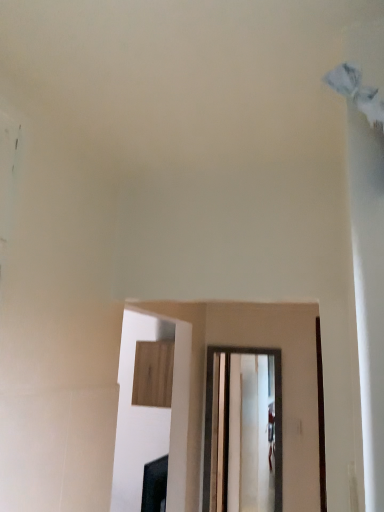
Question: From a real-world perspective, relative to wooden cabinet at upper center, is clear glass door at center vertically above or below?

Choices:
 (A) above
 (B) below

Answer: (B)

Question: Is clear glass door at center spatially inside wooden cabinet at upper center, or outside of it?

Choices:
 (A) inside
 (B) outside

Answer: (B)

Question: From the image's perspective, is clear glass door at center positioned above or below wooden cabinet at upper center?

Choices:
 (A) above
 (B) below

Answer: (B)

Question: From the image's perspective, is wooden cabinet at upper center located above or below clear glass door at center?

Choices:
 (A) above
 (B) below

Answer: (A)

Question: Looking at their shapes, would you say wooden cabinet at upper center is wider or thinner than clear glass door at center?

Choices:
 (A) wide
 (B) thin

Answer: (A)

Question: Considering the positions of wooden cabinet at upper center and clear glass door at center in the image, is wooden cabinet at upper center bigger or smaller than clear glass door at center?

Choices:
 (A) big
 (B) small

Answer: (A)

Question: Is wooden cabinet at upper center to the left or to the right of clear glass door at center in the image?

Choices:
 (A) right
 (B) left

Answer: (B)